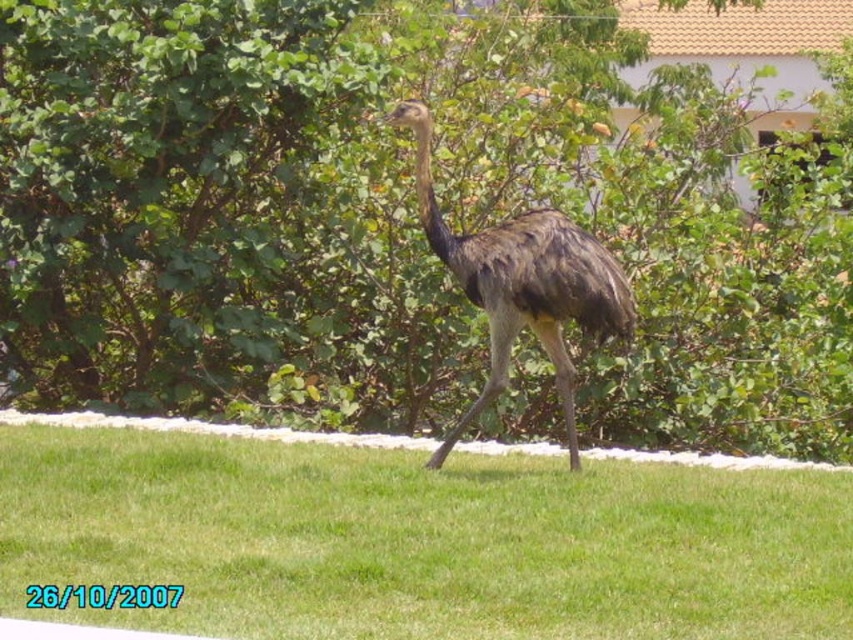
Which is behind, point (113, 500) or point (583, 234)?

The point (583, 234) is more distant.

Between green grass at center and brown feathered ostrich at center, which one has more height?

brown feathered ostrich at center

Find the location of `green grass at center`. green grass at center is located at coordinates (421, 540).

What are the coordinates of `green grass at center` in the screenshot? It's located at (421, 540).

Is green leafy tree at center positioned before green grass at center?

No, green leafy tree at center is further to the viewer.

Does point (624, 65) come closer to viewer compared to point (341, 554)?

No, (624, 65) is further to viewer.

The image size is (853, 640). In order to click on green leafy tree at center in this screenshot , I will do `click(399, 218)`.

Is point (129, 220) behind point (553, 248)?

Yes, point (129, 220) is farther from viewer.

Find the location of a particular element. This screenshot has width=853, height=640. green leafy tree at center is located at coordinates (399, 218).